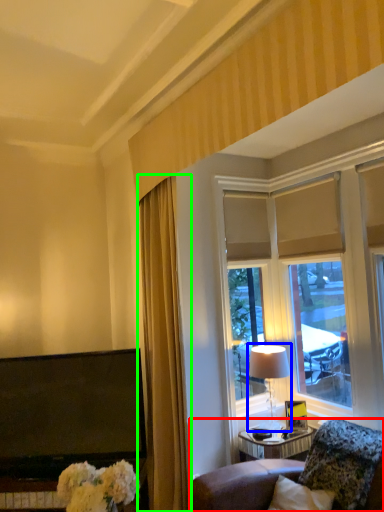
Question: Considering the real-world distances, which object is farthest from furniture (highlighted by a red box)? table lamp (highlighted by a blue box) or curtain (highlighted by a green box)?

Choices:
 (A) table lamp
 (B) curtain

Answer: (B)